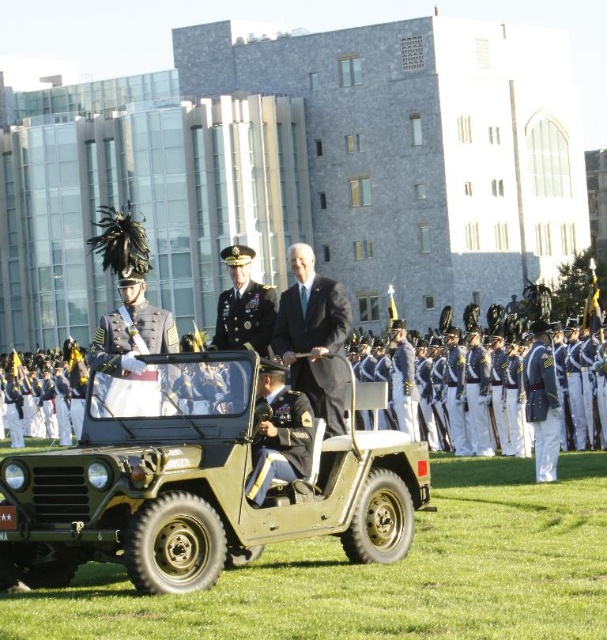
Does matte green metal jeep at center appear on the left side of blue uniform at center?

Indeed, matte green metal jeep at center is positioned on the left side of blue uniform at center.

The height and width of the screenshot is (640, 607). In order to click on matte green metal jeep at center in this screenshot , I will do `click(203, 480)`.

This screenshot has height=640, width=607. Find the location of `matte green metal jeep at center`. matte green metal jeep at center is located at coordinates (203, 480).

Which is in front, point (271, 372) or point (537, 452)?

Point (271, 372) is in front.

Is point (307, 465) behind point (538, 449)?

That is False.

Does point (299, 400) come closer to viewer compared to point (538, 397)?

Yes, point (299, 400) is closer to viewer.

Where is `dark blue fabric uniform at center`? The width and height of the screenshot is (607, 640). dark blue fabric uniform at center is located at coordinates (279, 436).

Is blue uniform at center to the right of shiny gold uniform at center from the viewer's perspective?

Indeed, blue uniform at center is positioned on the right side of shiny gold uniform at center.

Is point (354, 348) behind point (146, 378)?

Yes, point (354, 348) is behind point (146, 378).

Who is more distant from viewer, (526, 355) or (126, 413)?

Point (526, 355)

The image size is (607, 640). In order to click on blue uniform at center in this screenshot , I will do `click(480, 394)`.